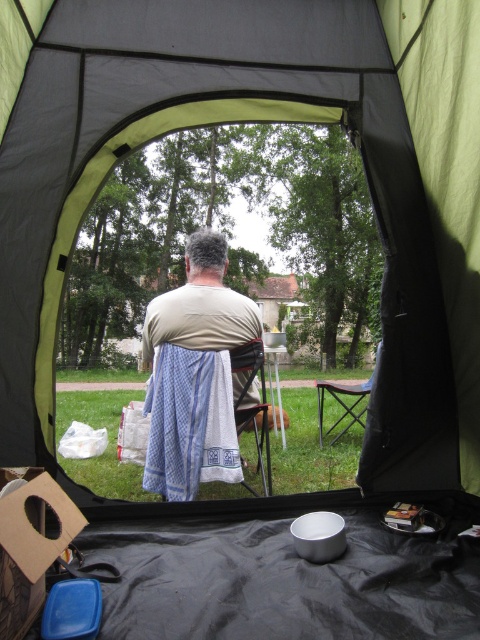
Consider the image. You are setting up a picnic area and need to place the blue checkered apron at center and the wooden folding chair at center. Based on their sizes, which item should be placed closer to the edge of the picnic blanket to avoid overcrowding?

The blue checkered apron at center has a lesser width compared to the wooden folding chair at center, so it should be placed closer to the edge to avoid overcrowding.

You are setting up a camping kitchen inside the tent and need to place both the blue checkered apron at center and the wooden folding chair at center. Given their sizes, which item should you prioritize placing first to ensure there is enough space for both?

The blue checkered apron at center is smaller than the wooden folding chair at center, so you should prioritize placing the wooden folding chair at center first to ensure there is enough space for both items.

You are inside the tent and want to know which of the two points, point (x=196, y=323) or point (x=342, y=388), is closer to you. Based on the scene description, which point is nearer?

Point (x=196, y=323) is closer to the camera than point (x=342, y=388), so it is nearer to you inside the tent.